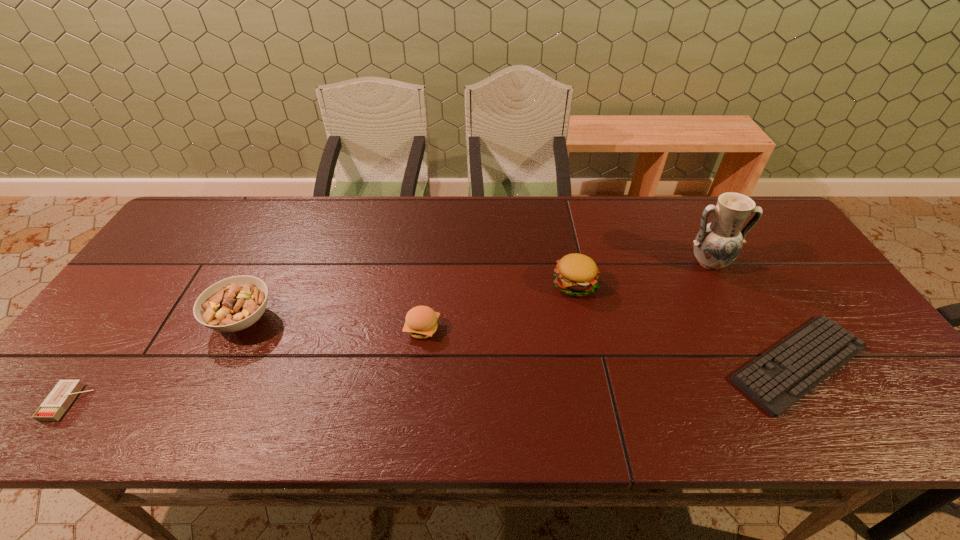
This screenshot has width=960, height=540. Identify the location of object positioned at the near right corner. (777, 379).

This screenshot has height=540, width=960. Identify the location of vacant space at the far edge of the desktop. (558, 218).

The image size is (960, 540). In the image, there is a desktop. What are the coordinates of `free space at the near edge` in the screenshot? It's located at (153, 427).

Locate an element on the screen. The width and height of the screenshot is (960, 540). vacant space at the left edge of the desktop is located at coordinates (156, 292).

In order to click on vacant area at the right edge in this screenshot , I will do `click(822, 295)`.

In the image, there is a desktop. Identify the location of vacant area at the near left corner. This screenshot has height=540, width=960. (65, 430).

Where is `free point between the tallest object and the second object from left to right`? This screenshot has width=960, height=540. free point between the tallest object and the second object from left to right is located at coordinates [475, 291].

Where is `empty space that is in between the stew and the matchbox`? The image size is (960, 540). empty space that is in between the stew and the matchbox is located at coordinates (156, 361).

I want to click on free area in between the fifth object from right to left and the shorter hamburger, so click(332, 324).

Image resolution: width=960 pixels, height=540 pixels. What are the coordinates of `free point between the right hamburger and the shortest object` in the screenshot? It's located at (686, 323).